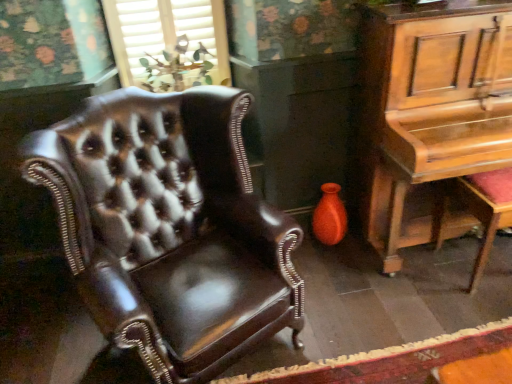
Where is `vacant space that is in between shiny brown leather armchair at left and wooden piano at right`? Image resolution: width=512 pixels, height=384 pixels. vacant space that is in between shiny brown leather armchair at left and wooden piano at right is located at coordinates (368, 308).